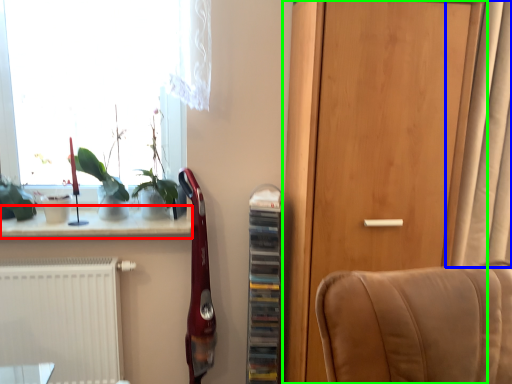
Question: Which is nearer to the window sill (highlighted by a red box)? curtain (highlighted by a blue box) or door (highlighted by a green box).

Choices:
 (A) curtain
 (B) door

Answer: (B)